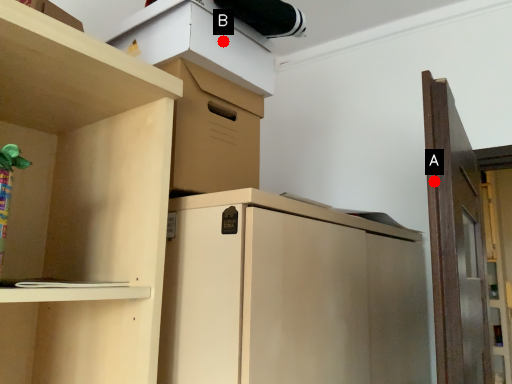
Question: Two points are circled on the image, labeled by A and B beside each circle. Which point is closer to the camera taking this photo?

Choices:
 (A) A is closer
 (B) B is closer

Answer: (A)